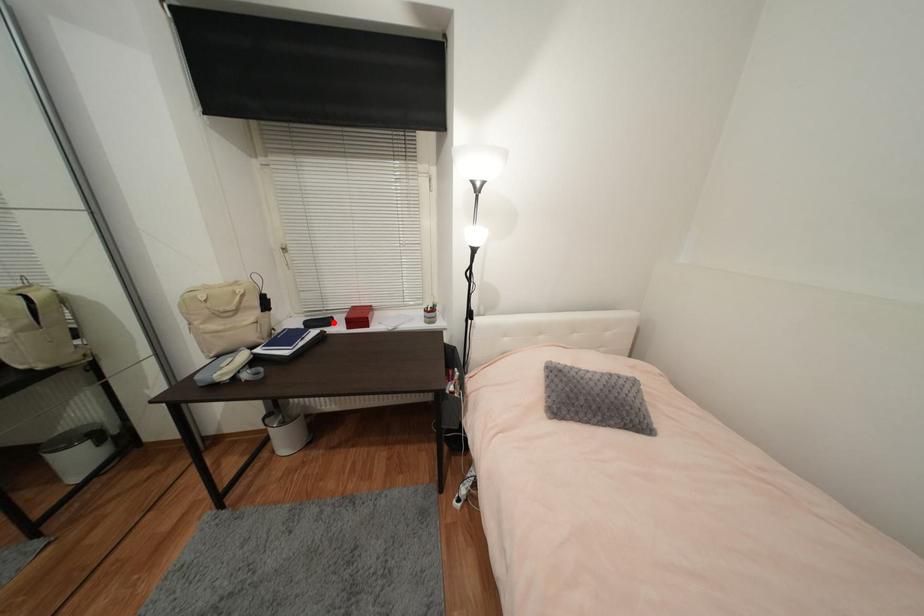
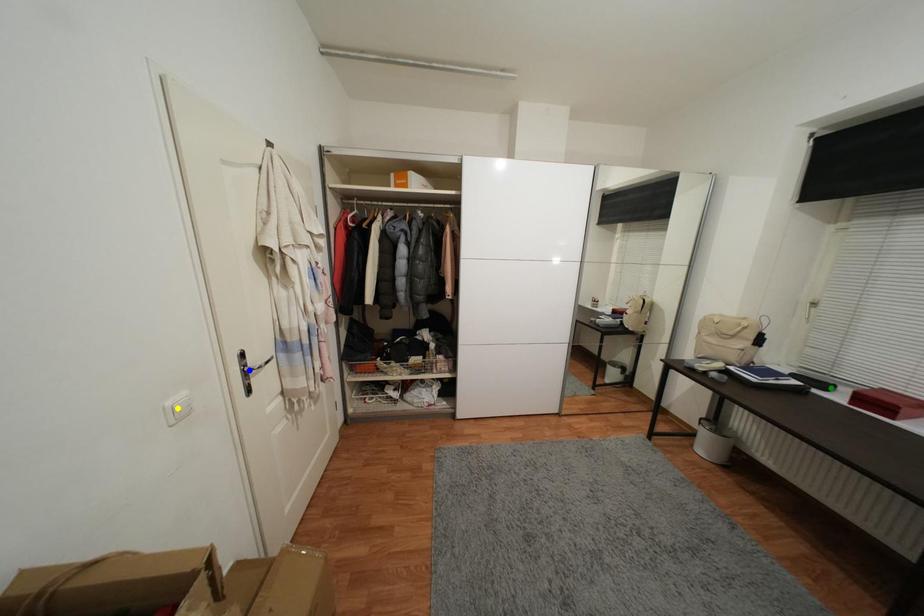
Question: I am providing you with two images of the same scene from different viewpoints. A red point is marked on the first image. You are given multiple points on the second image. Which point in image 2 represents the same 3d spot as the red point in image 1?

Choices:
 (A) blue point
 (B) green point
 (C) yellow point

Answer: (B)